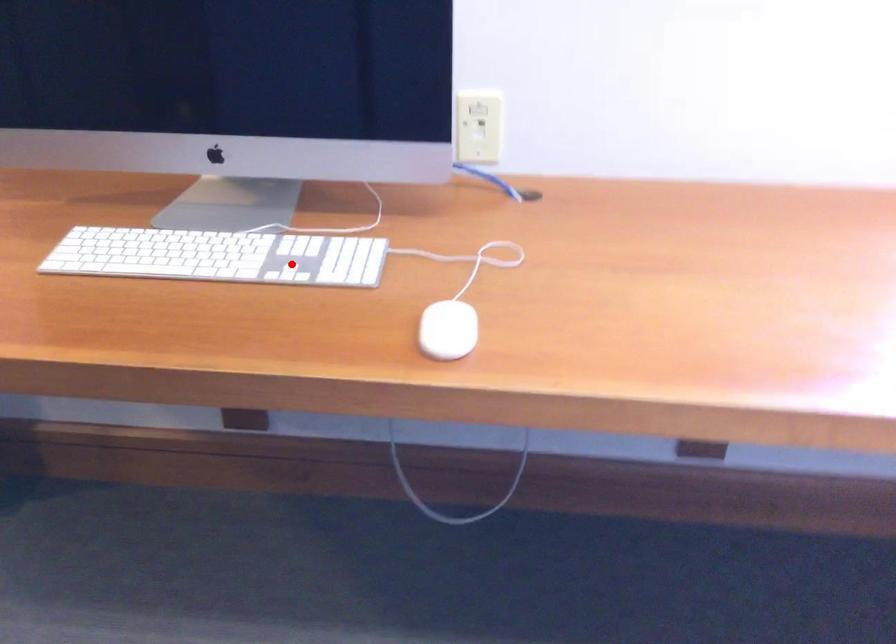
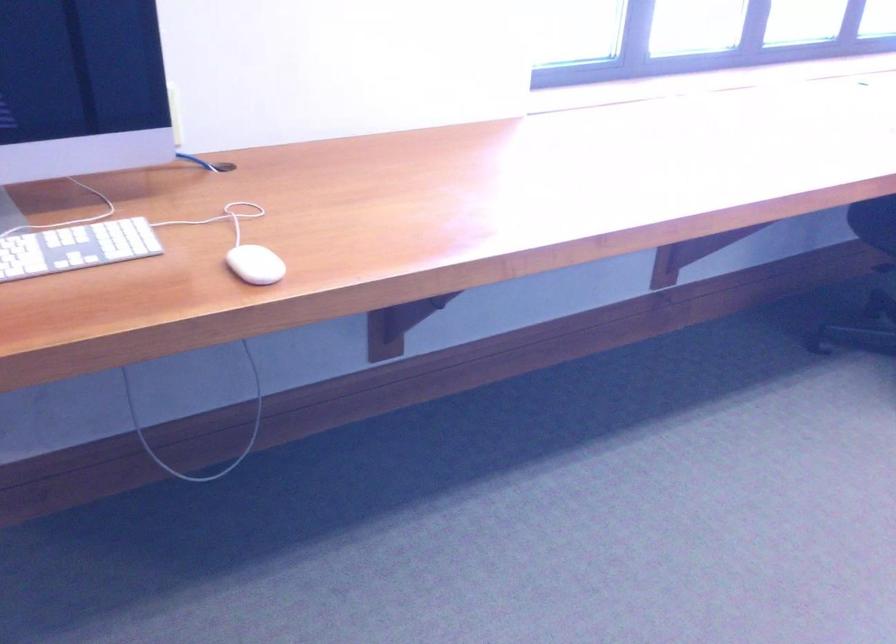
Question: I am providing you with two images of the same scene from different viewpoints. A red point is shown in image1. For the corresponding object point in image2, is it positioned nearer or farther from the camera?

Choices:
 (A) Nearer
 (B) Farther

Answer: (B)